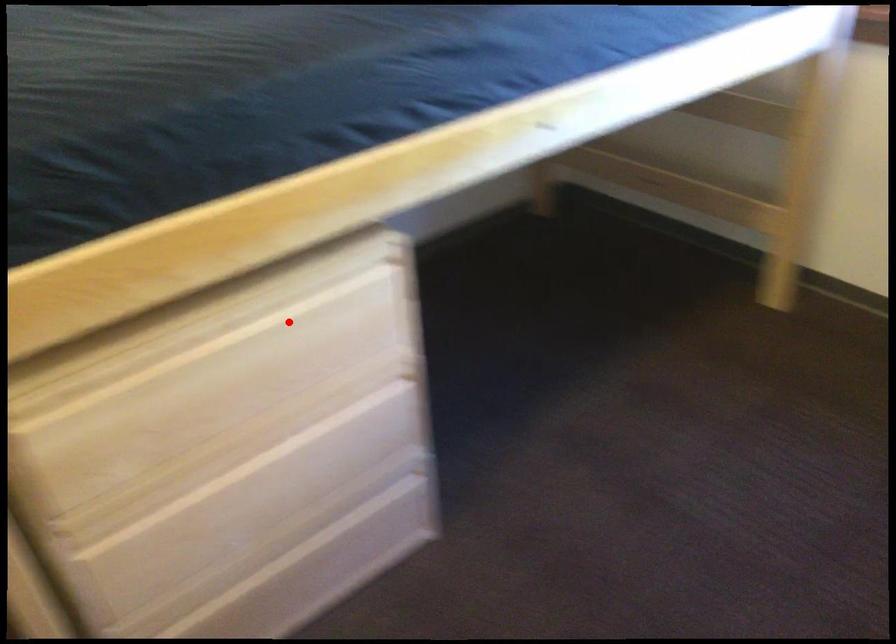
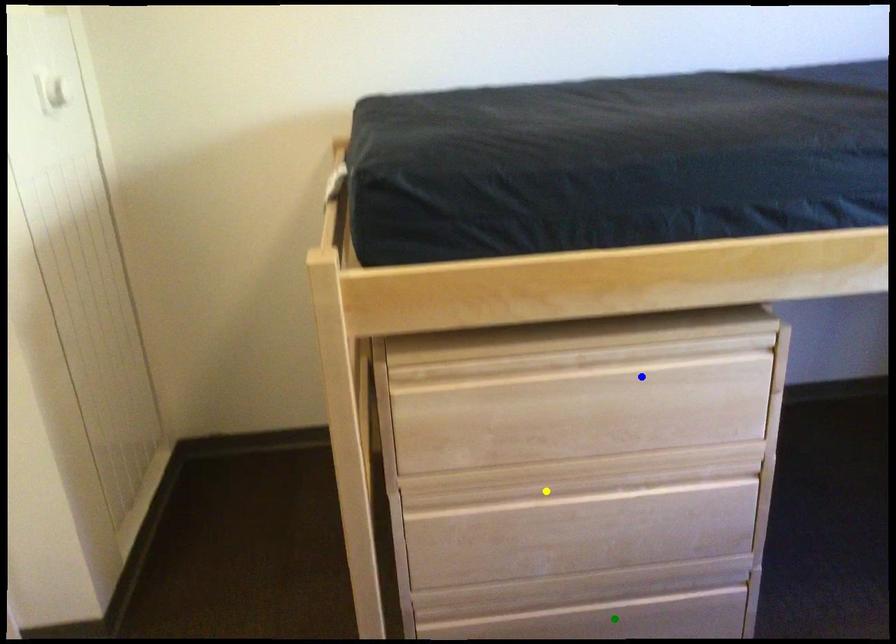
Question: I am providing you with two images of the same scene from different viewpoints. A red point is marked on the first image. You are given multiple points on the second image. Which point in image 2 represents the same 3d spot as the red point in image 1?

Choices:
 (A) green point
 (B) blue point
 (C) yellow point

Answer: (B)